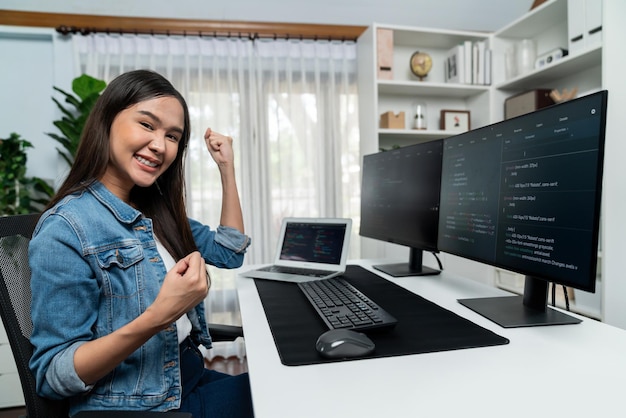
Locate an element on the screen. This screenshot has height=418, width=626. plant is located at coordinates (31, 196), (12, 161), (67, 125).